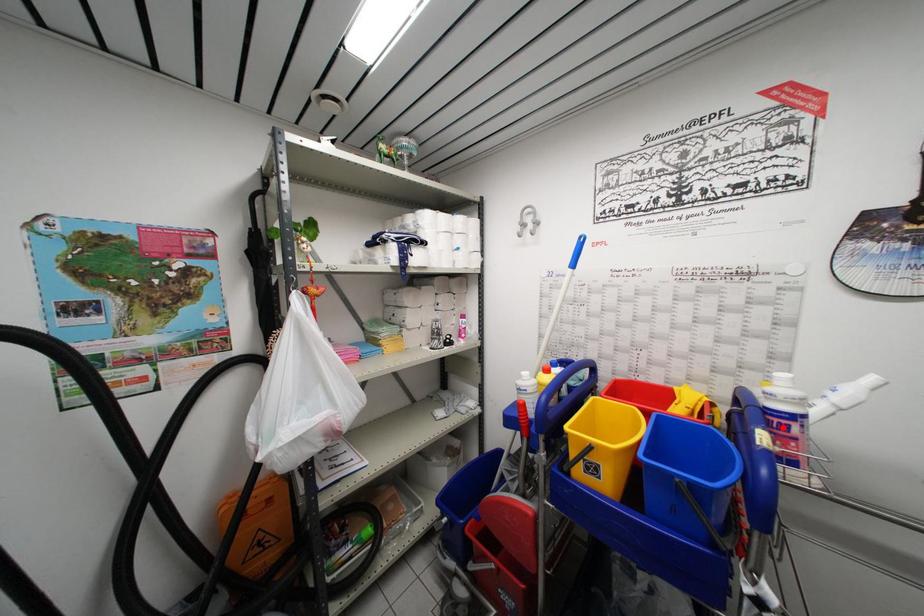
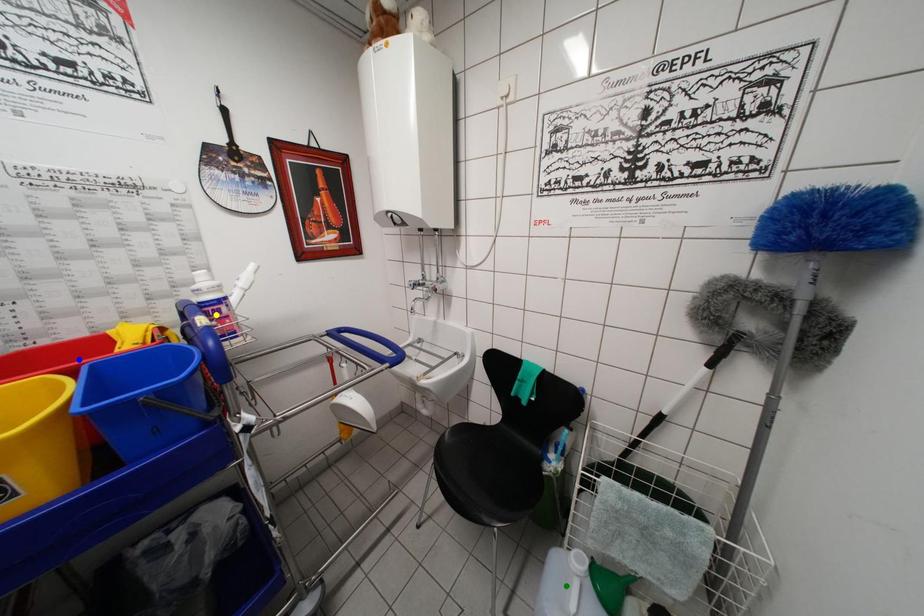
Question: I am providing you with two images of the same scene from different viewpoints. A red point is marked on the first image. You are given multiple points on the second image. In image 2, which mark is for the same physical point as the one in image 1?

Choices:
 (A) blue point
 (B) green point
 (C) yellow point

Answer: (C)